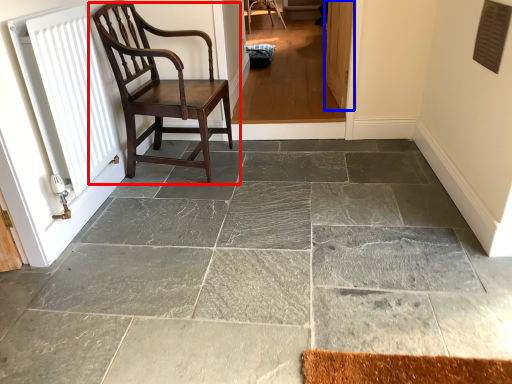
Question: Which object is further to the camera taking this photo, chair (highlighted by a red box) or screen door (highlighted by a blue box)?

Choices:
 (A) chair
 (B) screen door

Answer: (B)